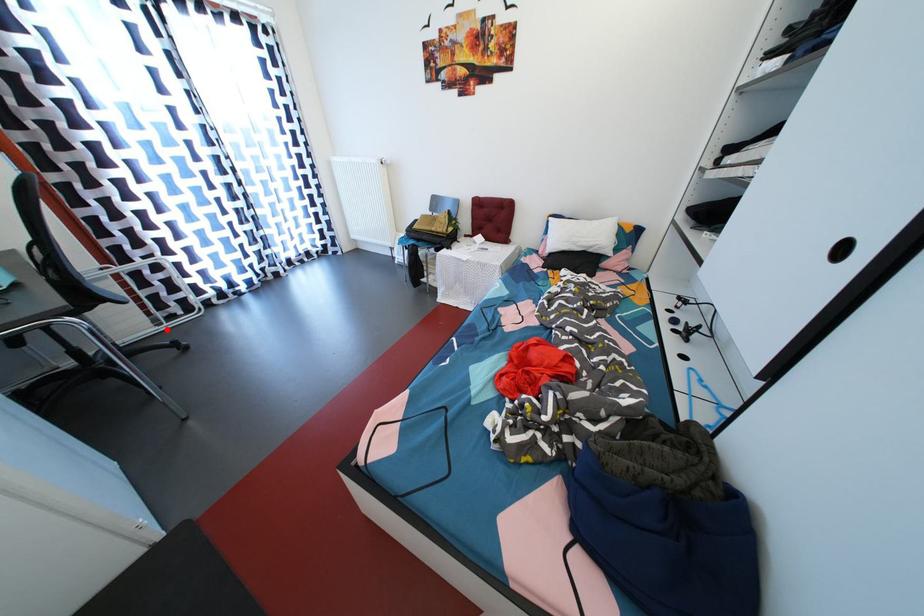
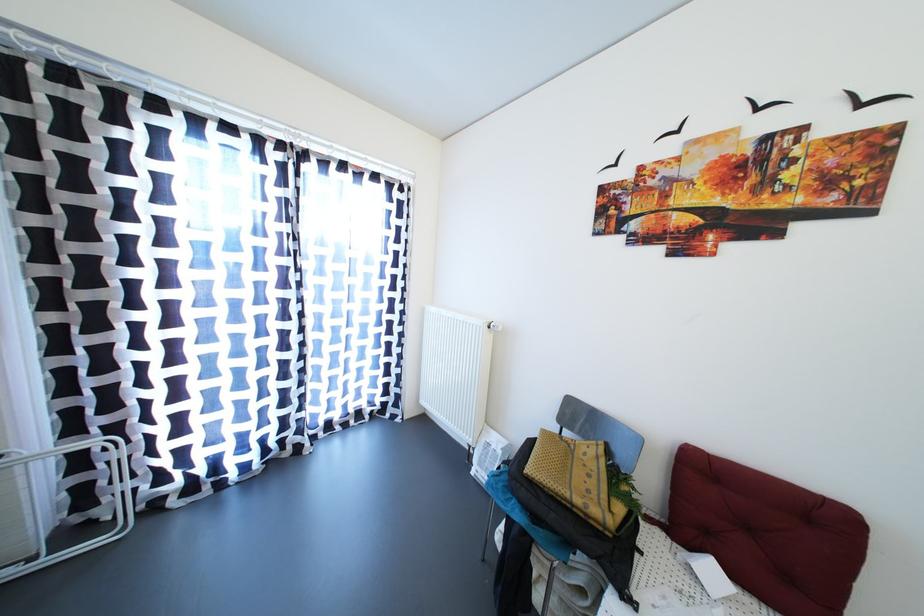
In the second image, find the point that corresponds to the highlighted location in the first image.

(39, 564)